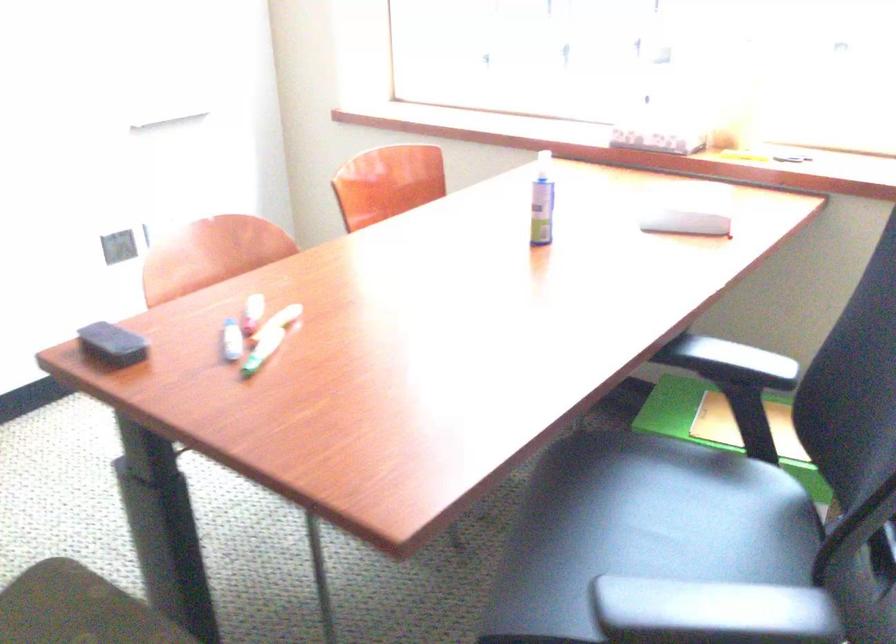
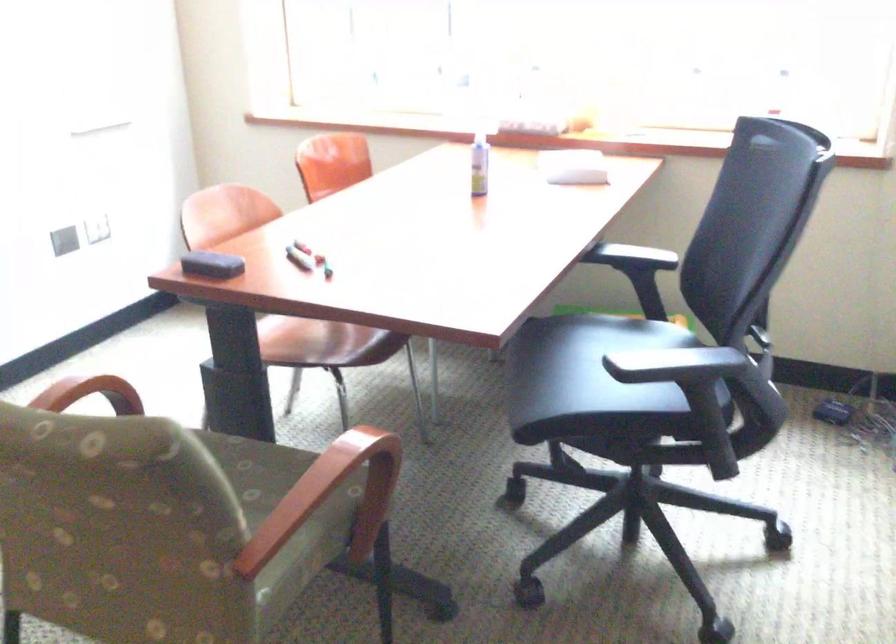
Find the pixel in the second image that matches [722,362] in the first image.

(632, 257)